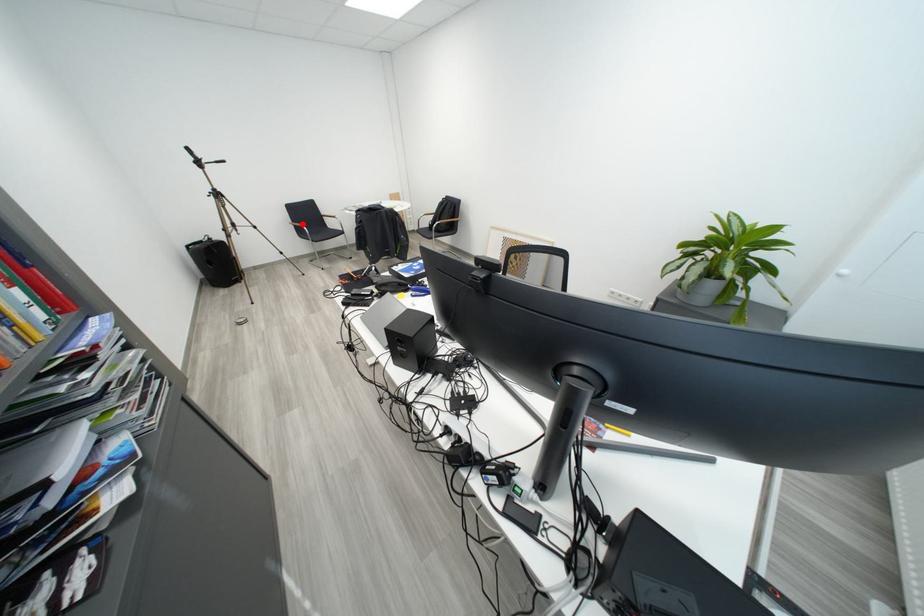
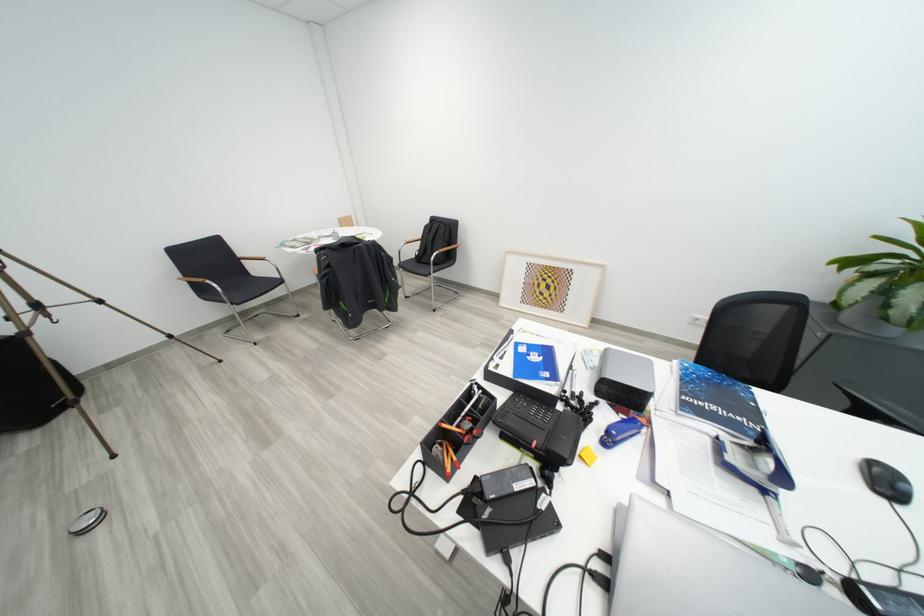
Question: I am providing you with two images of the same scene from different viewpoints. A red point is marked on the first image. Is the red point's position out of view in image 2?

Choices:
 (A) Yes
 (B) No

Answer: (B)